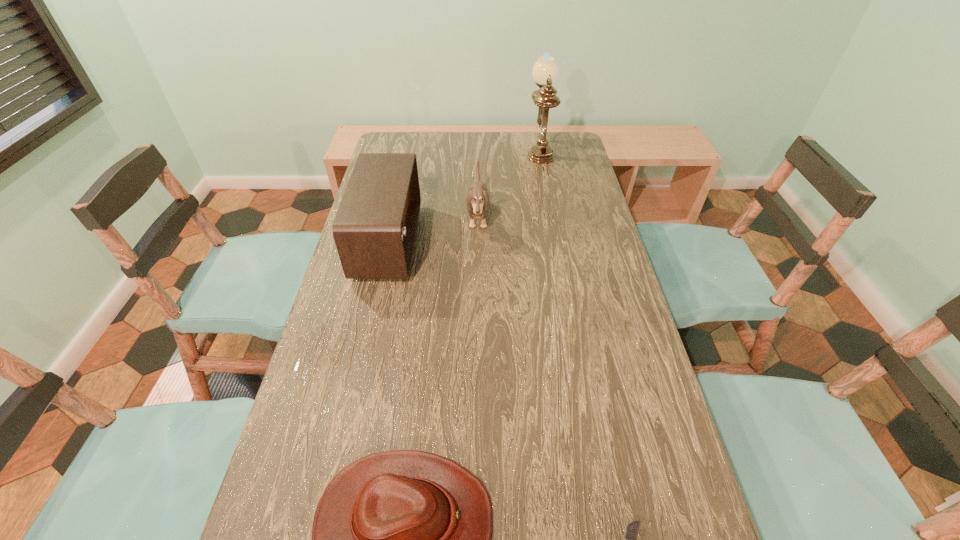
Where is `object located in the far right corner section of the desktop`? This screenshot has width=960, height=540. object located in the far right corner section of the desktop is located at coordinates (545, 70).

This screenshot has height=540, width=960. I want to click on free region at the left edge, so click(x=262, y=519).

Locate an element on the screen. This screenshot has width=960, height=540. blank area at the right edge is located at coordinates (564, 172).

At what (x,y) coordinates should I click in order to perform the action: click on blank space at the far left corner of the desktop. Please return your answer as a coordinate pair (x, y). This screenshot has width=960, height=540. Looking at the image, I should click on (392, 137).

Identify the location of vacant region at the far right corner. (579, 151).

Locate an element on the screen. This screenshot has width=960, height=540. free point between the puppy and the fourth shortest object is located at coordinates (433, 230).

Point out which object is positioned as the second nearest to the puppy. Please provide its 2D coordinates. Your answer should be formatted as a tuple, i.e. [(x, y)], where the tuple contains the x and y coordinates of a point satisfying the conditions above.

[(545, 70)]

Point out which object is positioned as the third nearest to the third tallest object. Please provide its 2D coordinates. Your answer should be formatted as a tuple, i.e. [(x, y)], where the tuple contains the x and y coordinates of a point satisfying the conditions above.

[(401, 539)]